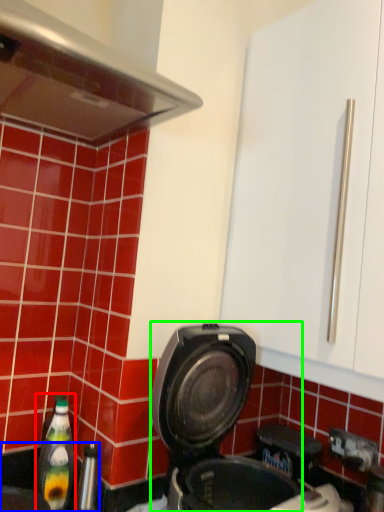
Question: Which is farther away from bottle (highlighted by a red box)? sink (highlighted by a blue box) or kitchen appliance (highlighted by a green box)?

Choices:
 (A) sink
 (B) kitchen appliance

Answer: (B)